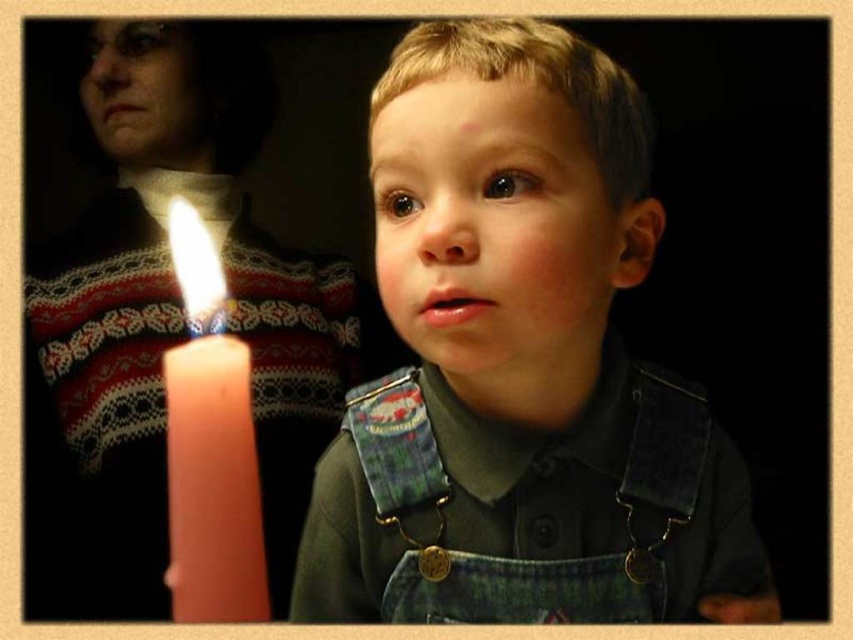
You are standing at the position of point (173, 352) and want to see the child in the foreground. Is the point (454, 333) blocking your view of the child?

Point (454, 333) is in front of point (173, 352), so yes, it is blocking your view of the child.